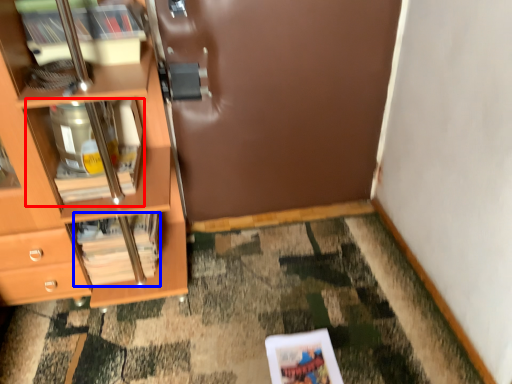
Question: Which object is further to the camera taking this photo, cabinet (highlighted by a red box) or magazine (highlighted by a blue box)?

Choices:
 (A) cabinet
 (B) magazine

Answer: (B)